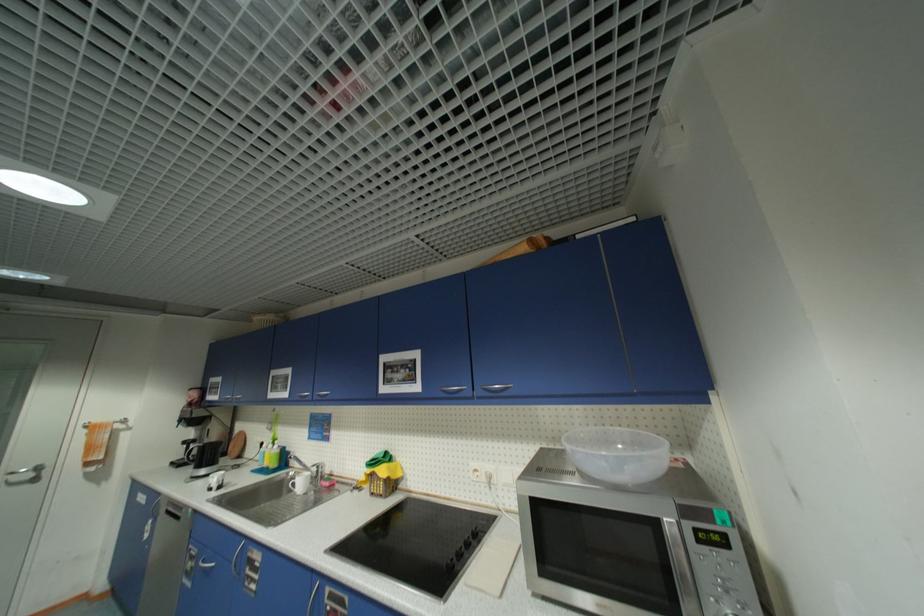
The height and width of the screenshot is (616, 924). What do you see at coordinates (675, 554) in the screenshot?
I see `the microwave door handle` at bounding box center [675, 554].